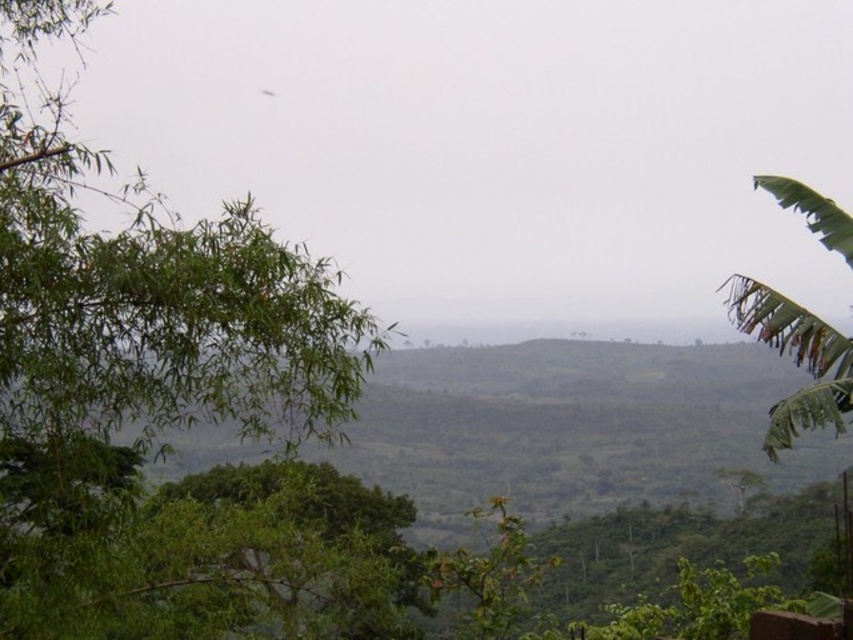
Between green leafy tree at upper left and green leafy tree at right, which one appears on the right side from the viewer's perspective?

From the viewer's perspective, green leafy tree at right appears more on the right side.

Looking at this image, does green leafy tree at upper left have a greater width compared to green leafy tree at right?

In fact, green leafy tree at upper left might be narrower than green leafy tree at right.

Describe the element at coordinates (160, 397) in the screenshot. I see `green leafy tree at upper left` at that location.

The image size is (853, 640). What are the coordinates of `green leafy tree at upper left` in the screenshot? It's located at (160, 397).